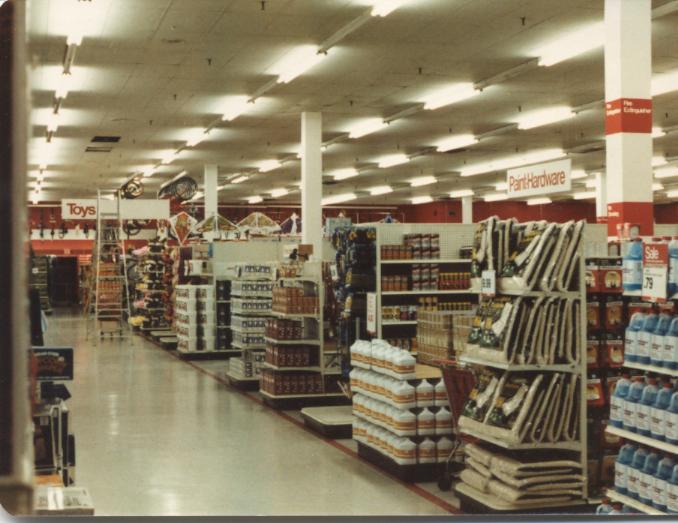
This screenshot has height=523, width=678. I want to click on shelf, so click(x=570, y=450), click(x=567, y=369), click(x=567, y=295), click(x=487, y=504).